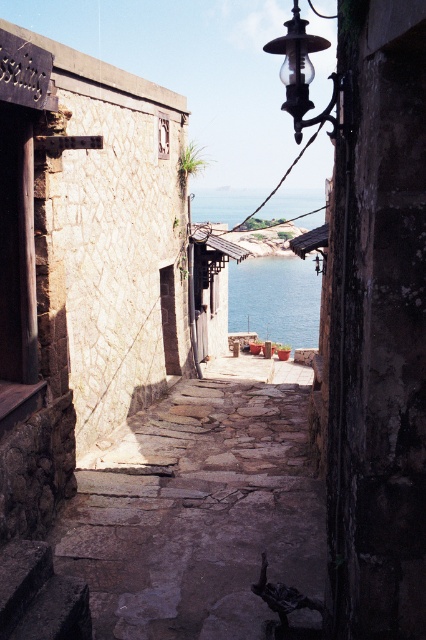
Based on the photo, is rustic stone path at center bigger than dark stone stairs at lower left?

Incorrect, rustic stone path at center is not larger than dark stone stairs at lower left.

Does rustic stone path at center have a greater height compared to dark stone stairs at lower left?

Incorrect, rustic stone path at center's height is not larger of dark stone stairs at lower left's.

Between point (296, 536) and point (25, 595), which one is positioned in front?

Point (25, 595)

I want to click on rustic stone path at center, so click(x=199, y=516).

Who is positioned more to the left, dark stone stairs at lower left or blue water at center?

dark stone stairs at lower left

Can you confirm if dark stone stairs at lower left is smaller than blue water at center?

Yes, dark stone stairs at lower left is smaller than blue water at center.

Who is more distant from viewer, (63, 589) or (311, 307)?

Positioned behind is point (311, 307).

I want to click on dark stone stairs at lower left, so (x=40, y=595).

Does rustic stone path at center come in front of blue water at center?

Yes, it is in front of blue water at center.

Can you confirm if rustic stone path at center is shorter than blue water at center?

Correct, rustic stone path at center is not as tall as blue water at center.

Find the location of a particular element. The width and height of the screenshot is (426, 640). rustic stone path at center is located at coordinates (199, 516).